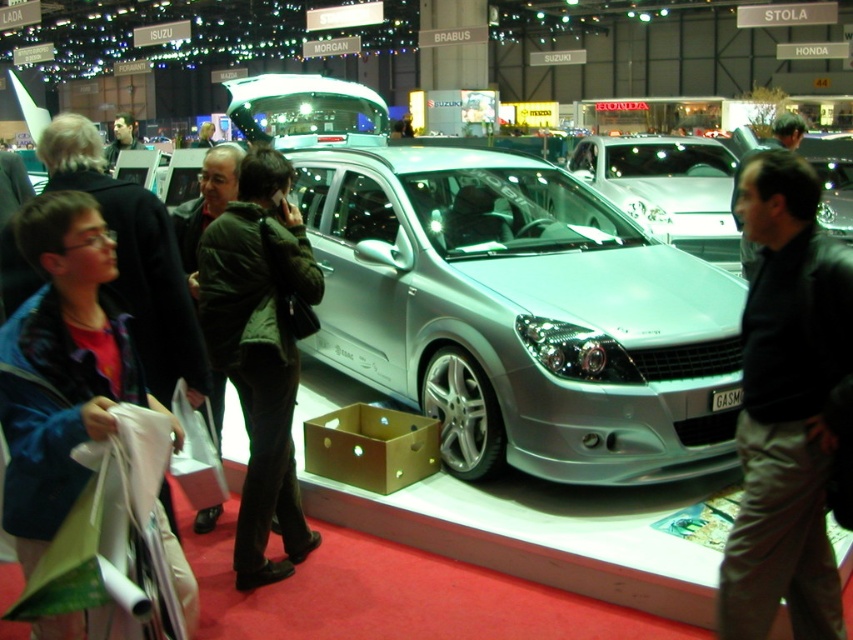
You are at an auto show and see two jackets displayed near a silver car on a platform. The jackets are the black leather jacket at center and the blue denim jacket at lower left. Which jacket is positioned to the right of the other?

The black leather jacket at center is positioned on the right side of blue denim jacket at lower left.

You are a photographer standing at the camera position. You want to take a photo of the silver car on the platform but notice the black leather jacket at center is blocking your view. Can you estimate how far you need to move forward to remove the obstruction?

The black leather jacket at center is 2.34 meters from the camera. To remove the obstruction, you would need to move forward past this distance, so moving forward at least 2.34 meters would allow you to take the photo without the jacket blocking the view.

Based on the coordinates provided in the description, where is the silver metallic car at center located in the image?

The silver metallic car at center is located at point coordinates of (x=520, y=314).